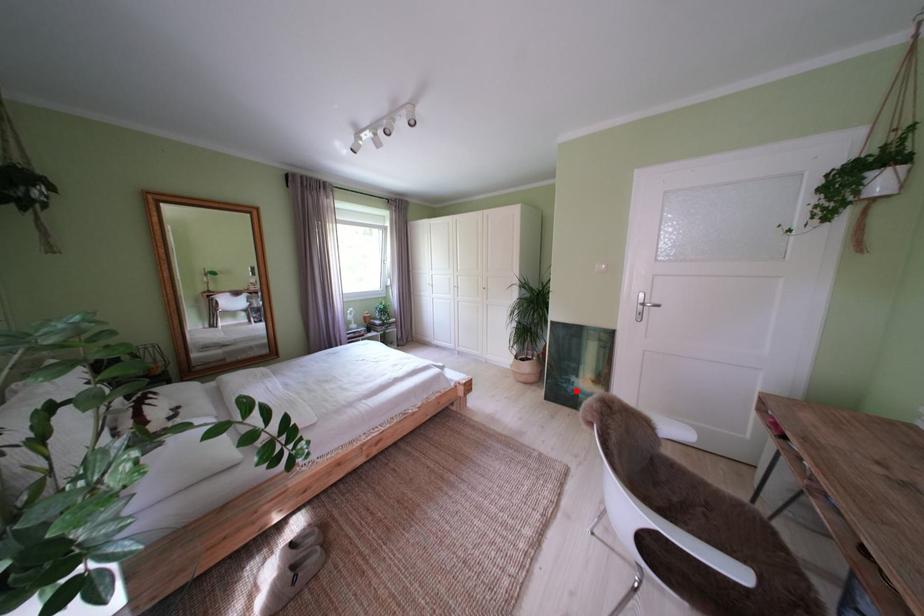
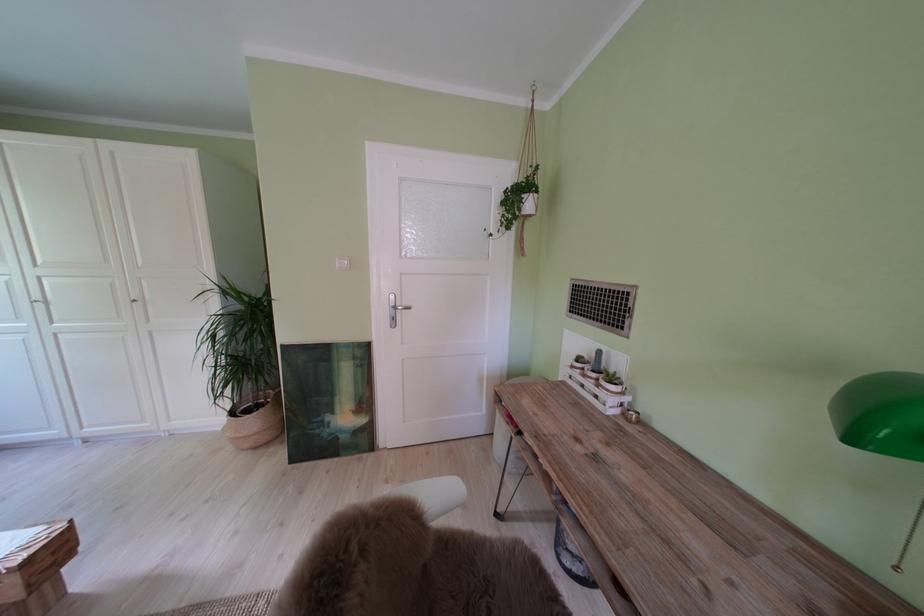
Where in the second image is the point corresponding to the highlighted location from the first image?

(329, 437)